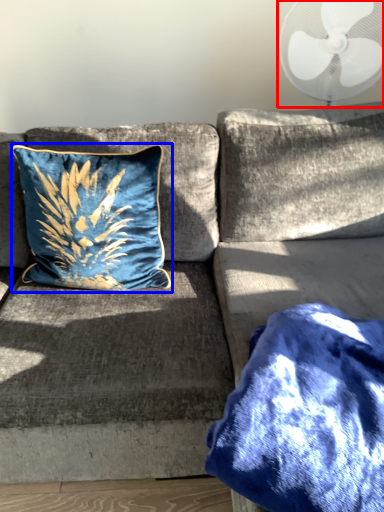
Question: Which object appears closest to the camera in this image, mechanical fan (highlighted by a red box) or pillow (highlighted by a blue box)?

Choices:
 (A) mechanical fan
 (B) pillow

Answer: (B)